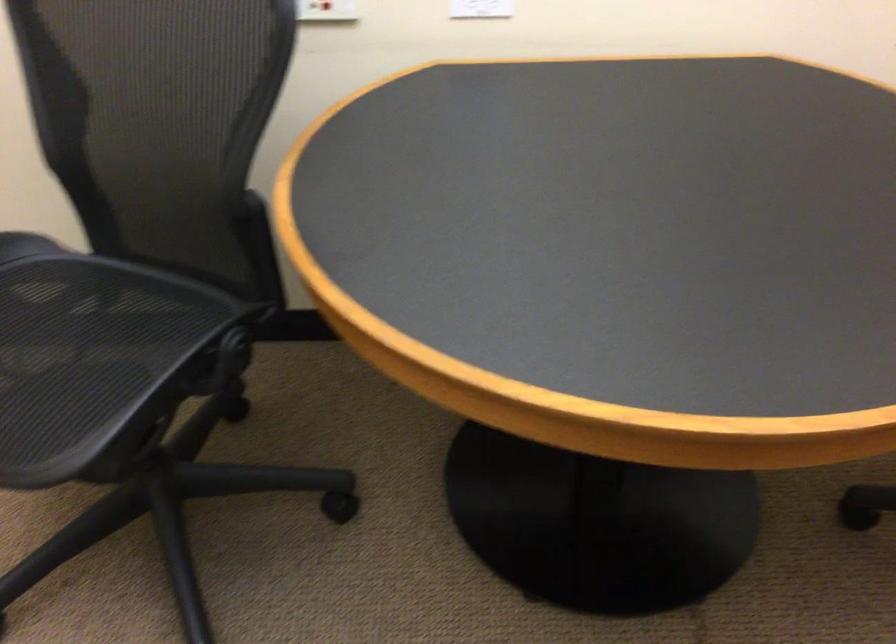
At what (x,y) coordinates should I click in order to perform the action: click on chair armrest. Please return your answer as a coordinate pair (x, y). Looking at the image, I should click on (264, 277).